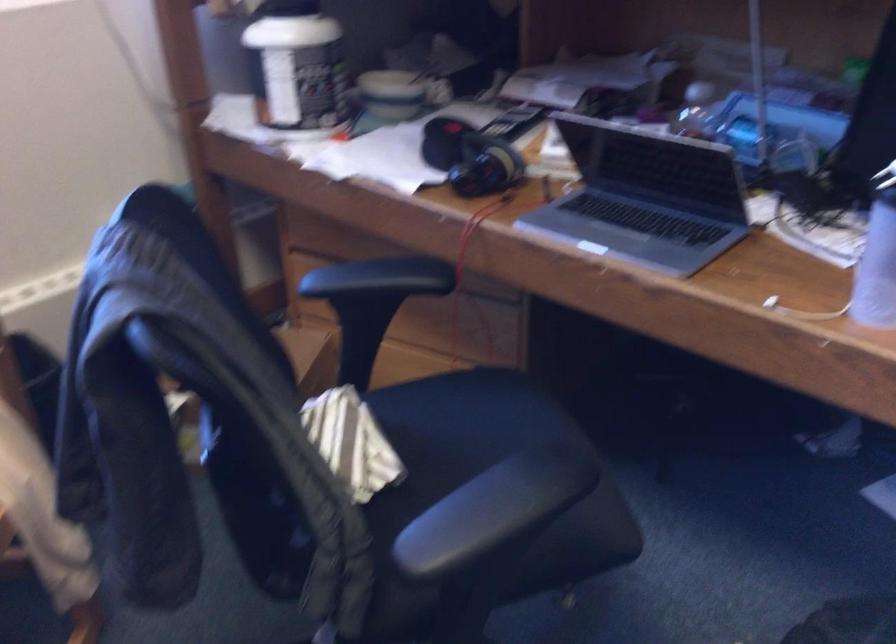
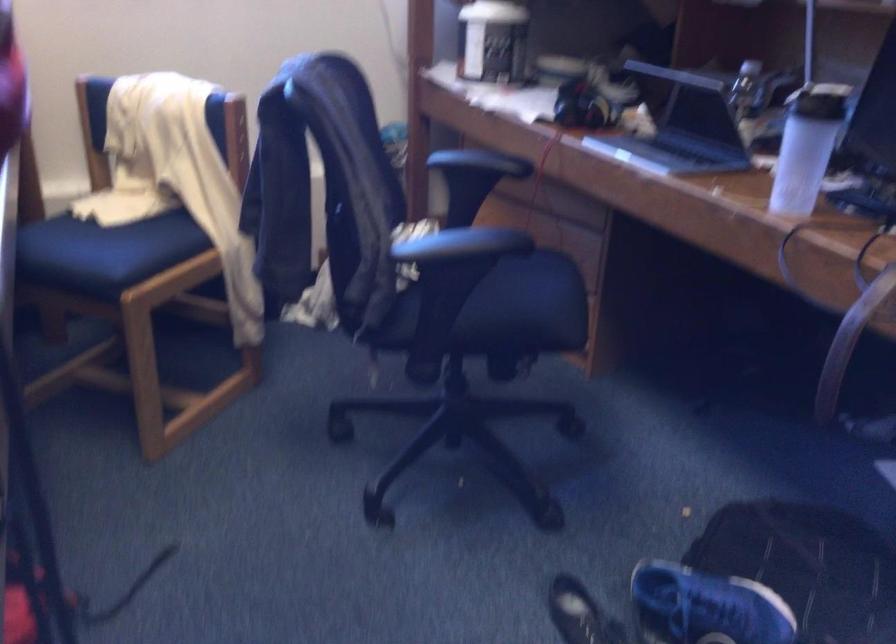
The point at (545, 526) is marked in the first image. Where is the corresponding point in the second image?

(515, 313)